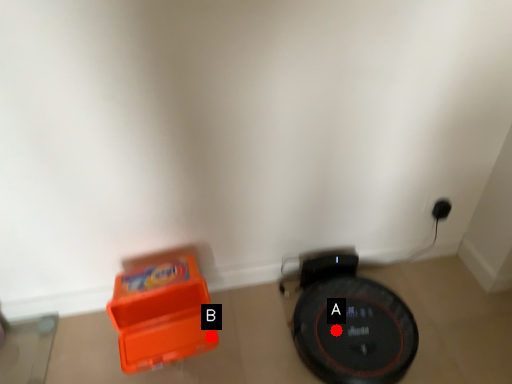
Question: Two points are circled on the image, labeled by A and B beside each circle. Which of the following is the closest to the observer?

Choices:
 (A) A is closer
 (B) B is closer

Answer: (B)